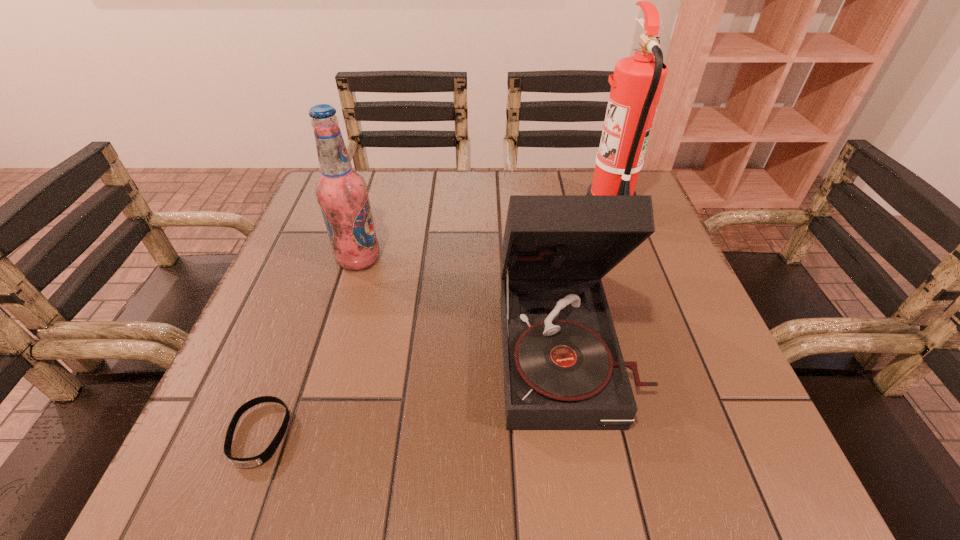
Locate an element on the screen. Image resolution: width=960 pixels, height=540 pixels. vacant area at the near edge of the desktop is located at coordinates (496, 475).

Where is `free space at the left edge of the desktop`? free space at the left edge of the desktop is located at coordinates (306, 287).

At what (x,y) coordinates should I click in order to perform the action: click on vacant region at the right edge. Please return your answer as a coordinate pair (x, y). This screenshot has width=960, height=540. Looking at the image, I should click on (698, 333).

In the image, there is a desktop. Find the location of `vacant region at the near left corner`. vacant region at the near left corner is located at coordinates (220, 437).

What are the coordinates of `vacant space that's between the second farthest object and the tallest object` in the screenshot? It's located at (484, 234).

You are a GUI agent. You are given a task and a screenshot of the screen. Output one action in this format:
    pyautogui.click(x=<x>, y=<y>)
    Task: Click on the free point between the alcohol and the wristband
    
    Given the screenshot: What is the action you would take?
    [x=309, y=347]

Locate an element on the screen. The width and height of the screenshot is (960, 540). free space between the shortest object and the phonograph_record is located at coordinates (415, 391).

The height and width of the screenshot is (540, 960). What are the coordinates of `vacant space that's between the wristband and the farthest object` in the screenshot? It's located at (435, 321).

Identify the location of vacant space in between the shortest object and the farthest object. This screenshot has height=540, width=960. (435, 321).

Find the location of a particular element. free point between the wristband and the fire extinguisher is located at coordinates (435, 321).